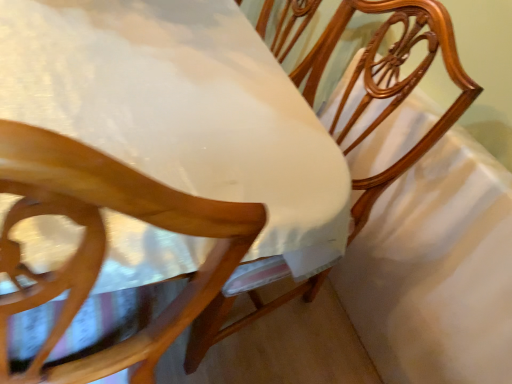
What do you see at coordinates (436, 270) in the screenshot? Image resolution: width=512 pixels, height=384 pixels. I see `white satin sheet at center` at bounding box center [436, 270].

Where is `wooden chair at center`? The image size is (512, 384). wooden chair at center is located at coordinates (389, 81).

Describe the element at coordinates (183, 110) in the screenshot. I see `white glossy table at center` at that location.

Where is `white satin sheet at center`? white satin sheet at center is located at coordinates (436, 270).

From the image's perspective, which is below, wooden chair at center or white glossy table at center?

white glossy table at center.

Do you think wooden chair at center is within white glossy table at center, or outside of it?

wooden chair at center lies outside white glossy table at center.

From the picture: How different are the orientations of wooden chair at center and white glossy table at center in degrees?

wooden chair at center and white glossy table at center are facing 101 degrees away from each other.

Considering the sizes of objects white satin sheet at center and wooden chair at center in the image provided, who is taller, white satin sheet at center or wooden chair at center?

white satin sheet at center is taller.

Is point (463, 191) positioned after point (306, 84)?

No, it is not.

From the image's perspective, is white satin sheet at center located above wooden chair at center?

No, from the image's perspective, white satin sheet at center is not over wooden chair at center.

How much distance is there between white satin sheet at center and wooden chair at center?

white satin sheet at center is 7.86 inches away from wooden chair at center.

Is white glossy table at center at the back of white satin sheet at center?

white satin sheet at center is not turned away from white glossy table at center.

From the image's perspective, does white satin sheet at center appear higher than white glossy table at center?

Actually, white satin sheet at center appears below white glossy table at center in the image.

What's the angular difference between white satin sheet at center and white glossy table at center's facing directions?

The facing directions of white satin sheet at center and white glossy table at center are 92.9 degrees apart.

Is white satin sheet at center far from white glossy table at center?

No, there isn't a large distance between white satin sheet at center and white glossy table at center.

Where is `table positioned vertically above the white satin sheet at center (from a real-world perspective)`? The width and height of the screenshot is (512, 384). table positioned vertically above the white satin sheet at center (from a real-world perspective) is located at coordinates (183, 110).

Considering the points (185, 156) and (489, 350), which point is behind, point (185, 156) or point (489, 350)?

The point (489, 350) is farther.

Which of these two, white glossy table at center or white satin sheet at center, stands shorter?

white satin sheet at center.

Is white glossy table at center located outside white satin sheet at center?

white glossy table at center lies outside white satin sheet at center's area.

What's the angular difference between wooden chair at center and white satin sheet at center's facing directions?

There is a 7.76-degree angle between the facing directions of wooden chair at center and white satin sheet at center.

Which object is positioned more to the right, wooden chair at center or white satin sheet at center?

white satin sheet at center is more to the right.

How distant is wooden chair at center from white satin sheet at center?

They are 7.86 inches apart.

From the image's perspective, which object appears higher, wooden chair at center or white satin sheet at center?

wooden chair at center, from the image's perspective.

Is white glossy table at center turned away from wooden chair at center?

white glossy table at center does not have its back to wooden chair at center.

From a real-world perspective, relative to wooden chair at center, is white glossy table at center vertically above or below?

From a real-world perspective, white glossy table at center is physically below wooden chair at center.

Between white glossy table at center and wooden chair at center, which one has smaller size?

wooden chair at center.

The image size is (512, 384). Find the location of `chair on the right of white glossy table at center`. chair on the right of white glossy table at center is located at coordinates (389, 81).

Find the location of a particular element. sheet behind the wooden chair at center is located at coordinates (436, 270).

When comparing their distances from wooden chair at center, does white glossy table at center or white satin sheet at center seem further?

white glossy table at center lies further to wooden chair at center than the other object.

Considering their positions, is white satin sheet at center positioned further to white glossy table at center than wooden chair at center?

white satin sheet at center is further to white glossy table at center.

Which object lies further to the anchor point white satin sheet at center, white glossy table at center or wooden chair at center?

The object further to white satin sheet at center is white glossy table at center.

Looking at the image, which one is located closer to white satin sheet at center, wooden chair at center or white glossy table at center?

wooden chair at center is positioned closer to the anchor white satin sheet at center.

Based on their spatial positions, is white satin sheet at center or white glossy table at center closer to wooden chair at center?

white satin sheet at center lies closer to wooden chair at center than the other object.

Based on the photo, when comparing their distances from white glossy table at center, does wooden chair at center or white satin sheet at center seem closer?

wooden chair at center is positioned closer to the anchor white glossy table at center.

Image resolution: width=512 pixels, height=384 pixels. In order to click on chair between white glossy table at center and white satin sheet at center in the horizontal direction in this screenshot , I will do `click(389, 81)`.